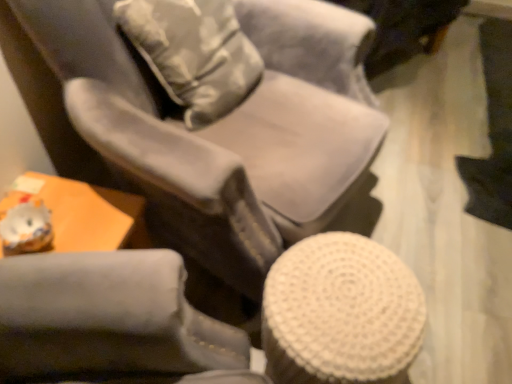
Question: Do you think white woven stool at lower right is within suede-like gray chair at center, or outside of it?

Choices:
 (A) inside
 (B) outside

Answer: (B)

Question: From a real-world perspective, is white woven stool at lower right positioned above or below suede-like gray chair at center?

Choices:
 (A) above
 (B) below

Answer: (B)

Question: Considering the real-world distances, which object is farthest from the suede-like gray chair at center?

Choices:
 (A) white woven stool at lower right
 (B) camouflage fabric throw pillow at upper center

Answer: (A)

Question: Which of these objects is positioned closest to the suede-like gray chair at center?

Choices:
 (A) camouflage fabric throw pillow at upper center
 (B) white woven stool at lower right

Answer: (A)